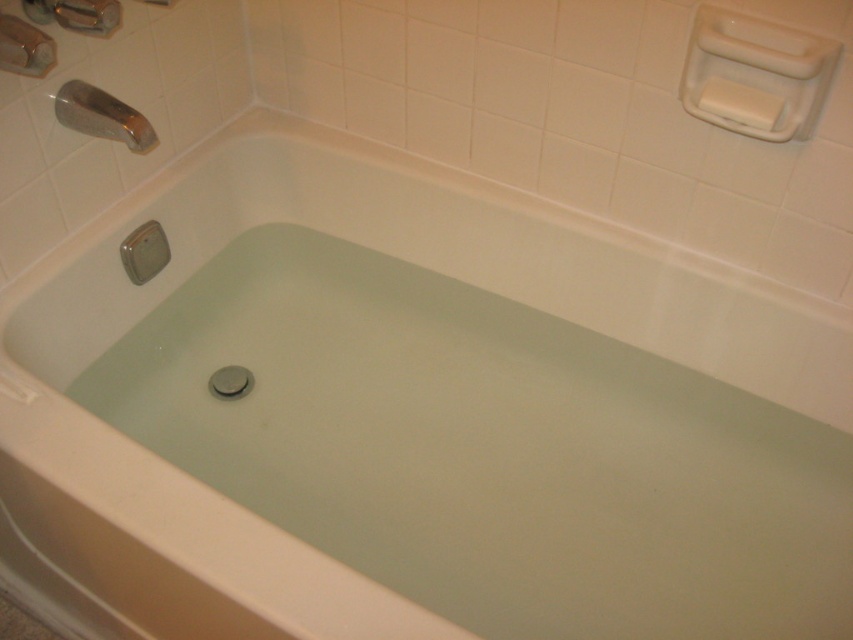
You are a contractor assessing bathroom fixtures. You need to install a new showerhead between the polished chrome faucet at upper left and the white matte soap at upper right. Which fixture should you move closer to the viewer to make space?

You should move the polished chrome faucet at upper left closer to the viewer because it is currently further away than the white matte soap at upper right, so adjusting its position would create space for the new showerhead.

You are standing in the bathroom and want to reach a point that is 1.08 meters away from you. Can you confirm if the point at coordinates point (x=68, y=122) is exactly that distance away?

The point (x=68, y=122) is exactly 1.08 meters away from the viewer, so yes, the point at coordinates point (x=68, y=122) is exactly 1.08 meters away.

You are a plumber inspecting the bathroom and need to locate the polished chrome faucet at upper left. According to the coordinates provided, where exactly is it positioned?

The polished chrome faucet at upper left is located at point (102, 115).